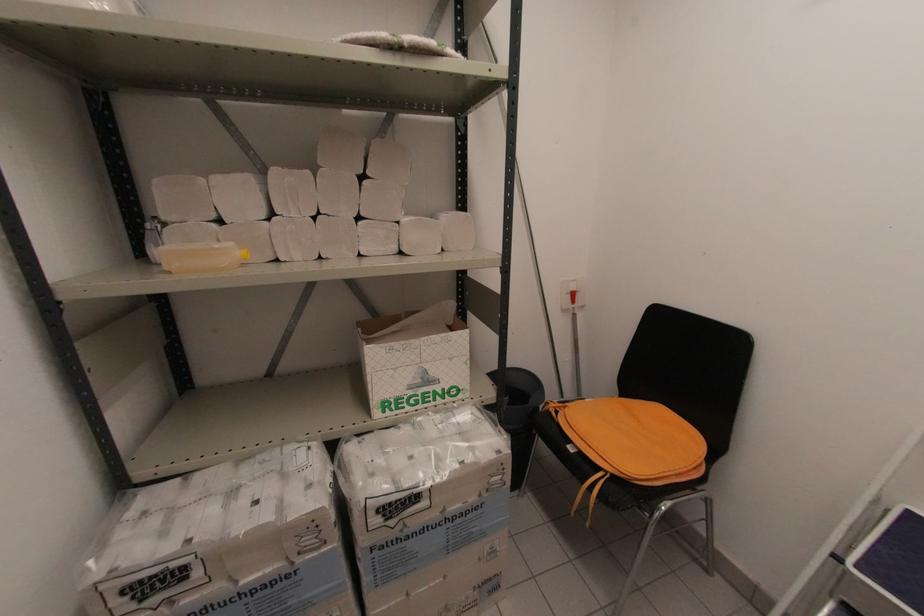
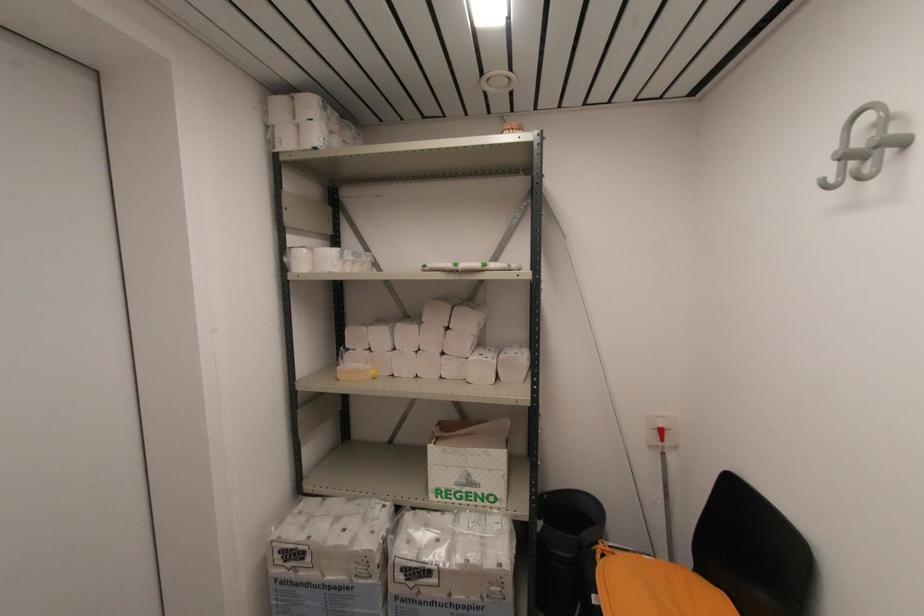
Locate, in the second image, the point that corresponds to (169,273) in the first image.

(339, 381)